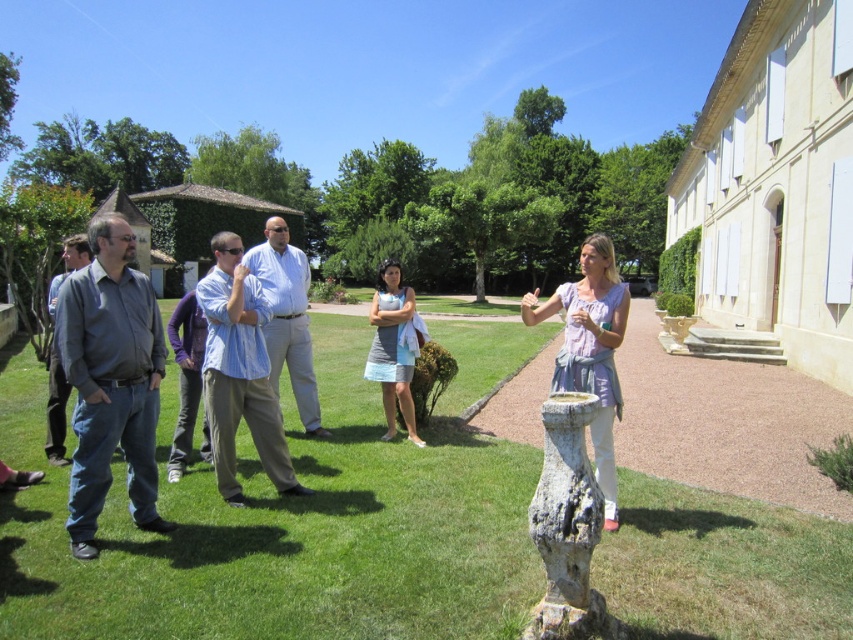
Question: Is light blue shirt at center smaller than light purple fabric dress at center?

Choices:
 (A) no
 (B) yes

Answer: (B)

Question: Observing the image, what is the correct spatial positioning of light purple fabric dress at center in reference to light blue denim dress at center?

Choices:
 (A) above
 (B) below

Answer: (A)

Question: Among these objects, which one is nearest to the camera?

Choices:
 (A) light purple fabric dress at center
 (B) light blue shirt at center
 (C) dark gray shirt at center

Answer: (A)

Question: Which point is closer to the camera?

Choices:
 (A) (222, 230)
 (B) (59, 385)
 (C) (154, 531)
 (D) (16, 588)

Answer: (D)

Question: Estimate the real-world distances between objects in this image. Which object is farther from the light purple fabric dress at center?

Choices:
 (A) dark gray shirt at center
 (B) stone fountain at center

Answer: (B)

Question: Considering the relative positions of light blue shirt at center and light blue denim dress at center in the image provided, where is light blue shirt at center located with respect to light blue denim dress at center?

Choices:
 (A) right
 (B) left

Answer: (B)